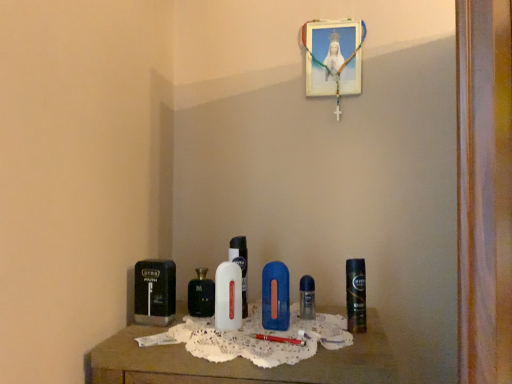
Question: Are black plastic razor at left, the first personal care when ordered from left to right, and clear plastic perfume at center, which appears as the first perfume when viewed from the right, far apart?

Choices:
 (A) no
 (B) yes

Answer: (A)

Question: Considering the relative positions of black plastic razor at left, which is the 3th personal care from right to left, and clear plastic perfume at center, which is the 2th perfume from back to front, in the image provided, is black plastic razor at left, which is the 3th personal care from right to left, to the right of clear plastic perfume at center, which is the 2th perfume from back to front, from the viewer's perspective?

Choices:
 (A) yes
 (B) no

Answer: (B)

Question: From a real-world perspective, is black plastic razor at left, the first personal care when ordered from left to right, positioned under clear plastic perfume at center, the fourth perfume from the left, based on gravity?

Choices:
 (A) yes
 (B) no

Answer: (B)

Question: Can you confirm if black plastic razor at left, the first personal care when ordered from left to right, is smaller than clear plastic perfume at center, which appears as the first perfume when viewed from the right?

Choices:
 (A) yes
 (B) no

Answer: (B)

Question: Does black plastic razor at left, the first personal care when ordered from left to right, turn towards clear plastic perfume at center, which appears as the first perfume when viewed from the right?

Choices:
 (A) yes
 (B) no

Answer: (B)

Question: Is wooden table at center in front of or behind clear plastic perfume at center, which is the 2th perfume from back to front, in the image?

Choices:
 (A) front
 (B) behind

Answer: (A)

Question: Does point (106, 367) appear closer or farther from the camera than point (302, 311)?

Choices:
 (A) farther
 (B) closer

Answer: (B)

Question: From a real-world perspective, is wooden table at center positioned above or below clear plastic perfume at center, which appears as the first perfume when viewed from the right?

Choices:
 (A) below
 (B) above

Answer: (A)

Question: Is wooden table at center to the left or to the right of clear plastic perfume at center, the 3th perfume positioned from the front, in the image?

Choices:
 (A) left
 (B) right

Answer: (A)

Question: Choose the correct answer: Is blue plastic razor at center, the 2th personal care from the left, inside white glossy bottle at center, the 4th perfume when ordered from back to front, or outside it?

Choices:
 (A) inside
 (B) outside

Answer: (B)

Question: Based on their positions, is blue plastic razor at center, arranged as the second personal care when viewed from the right, located to the left or right of white glossy bottle at center, marked as the 1th perfume in a front-to-back arrangement?

Choices:
 (A) left
 (B) right

Answer: (B)

Question: In terms of height, does blue plastic razor at center, arranged as the second personal care when viewed from the right, look taller or shorter compared to white glossy bottle at center, positioned as the 2th perfume in left-to-right order?

Choices:
 (A) short
 (B) tall

Answer: (A)

Question: Looking at their shapes, would you say blue plastic razor at center, arranged as the second personal care when viewed from the right, is wider or thinner than white glossy bottle at center, the third perfume positioned from the right?

Choices:
 (A) wide
 (B) thin

Answer: (B)

Question: In the image, is wooden table at center positioned in front of or behind white plastic bottle at center, which appears as the 2th perfume when viewed from the front?

Choices:
 (A) behind
 (B) front

Answer: (B)

Question: From the image's perspective, is wooden table at center above or below white plastic bottle at center, the third perfume when ordered from back to front?

Choices:
 (A) below
 (B) above

Answer: (A)